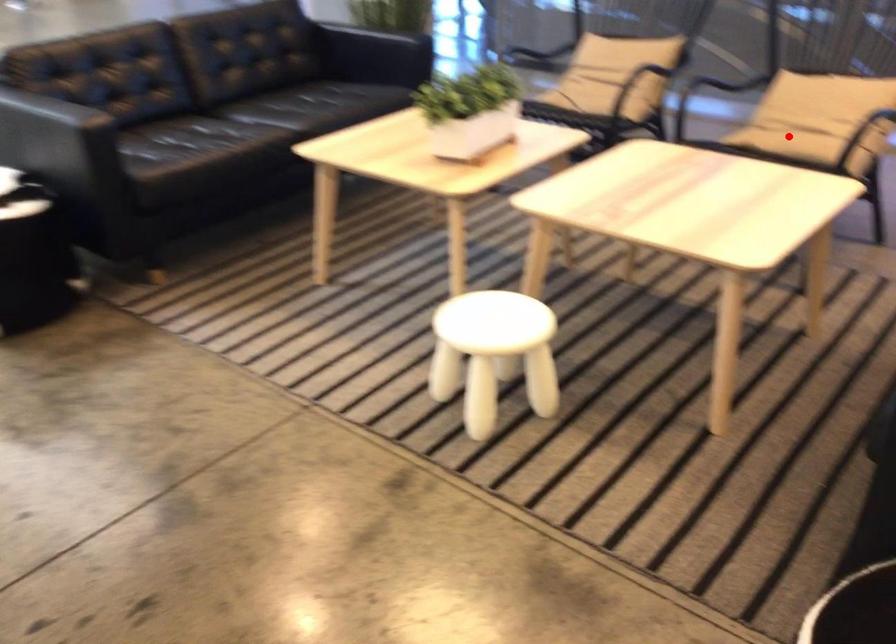
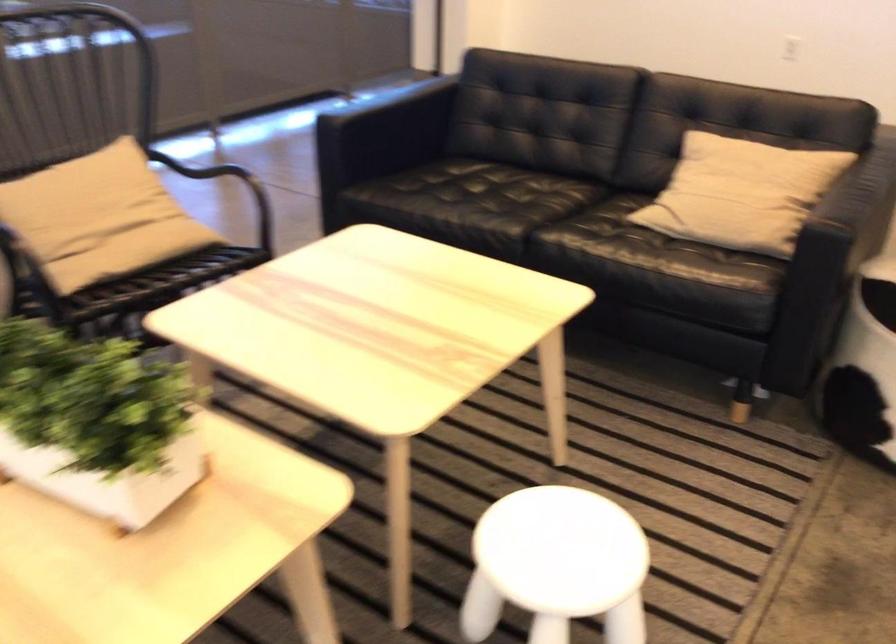
Question: I am providing you with two images of the same scene from different viewpoints. In image1, a red point is highlighted. Considering the same 3D point in image2, which of the following is correct?

Choices:
 (A) It is closer
 (B) It is farther

Answer: (A)